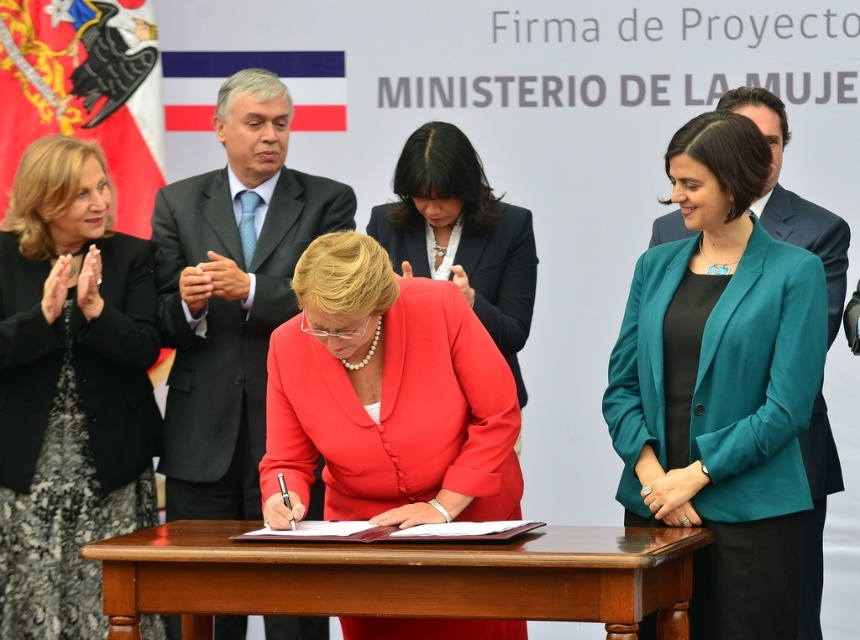
Question: Among these objects, which one is nearest to the camera?

Choices:
 (A) teal fabric jacket at center
 (B) matte black suit at center
 (C) matte red blazer at center
 (D) black lace dress at upper left

Answer: (C)

Question: Does matte black suit at center have a larger size compared to brown wooden table at center?

Choices:
 (A) yes
 (B) no

Answer: (A)

Question: Does teal fabric jacket at center lie in front of matte red blazer at center?

Choices:
 (A) yes
 (B) no

Answer: (B)

Question: Estimate the real-world distances between objects in this image. Which object is farther from the teal fabric jacket at center?

Choices:
 (A) matte red blazer at center
 (B) brown wooden table at center
 (C) matte black blazer at center

Answer: (C)

Question: Among these objects, which one is farthest from the camera?

Choices:
 (A) teal fabric jacket at center
 (B) brown wooden table at center

Answer: (A)

Question: Does black lace dress at upper left appear on the right side of matte black suit at center?

Choices:
 (A) no
 (B) yes

Answer: (A)